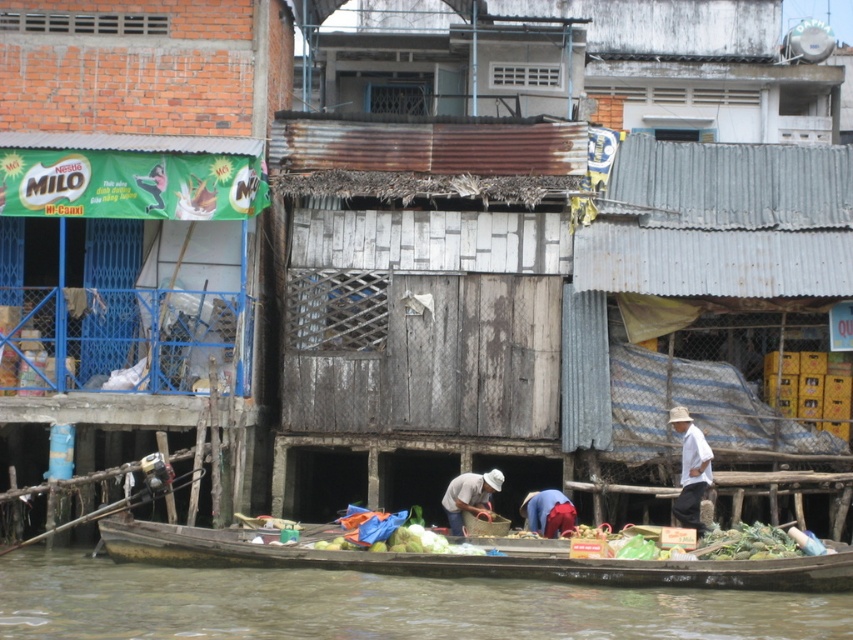
Is rusty corrugated metal hut at center positioned behind wooden canoe at lower center?

That is True.

Who is taller, rusty corrugated metal hut at center or wooden canoe at lower center?

Standing taller between the two is rusty corrugated metal hut at center.

Between point (167, 52) and point (396, 561), which one is positioned in front?

Point (396, 561)

Identify the location of rusty corrugated metal hut at center. Image resolution: width=853 pixels, height=640 pixels. (136, 212).

Find the location of `green leafy vegetables at center`. green leafy vegetables at center is located at coordinates (746, 541).

Which is behind, point (766, 532) or point (451, 522)?

Positioned behind is point (451, 522).

Who is more forward, (x=769, y=536) or (x=474, y=476)?

Point (x=769, y=536) is more forward.

Where is `green leafy vegetables at center`? This screenshot has width=853, height=640. green leafy vegetables at center is located at coordinates (746, 541).

Where is `brown wooden boat at lower center`? brown wooden boat at lower center is located at coordinates (376, 604).

Does point (431, 627) come in front of point (461, 522)?

Yes, it is.

Who is more distant from viewer, (105, 605) or (450, 497)?

The point (450, 497) is more distant.

This screenshot has height=640, width=853. Find the location of `brown wooden boat at lower center`. brown wooden boat at lower center is located at coordinates (376, 604).